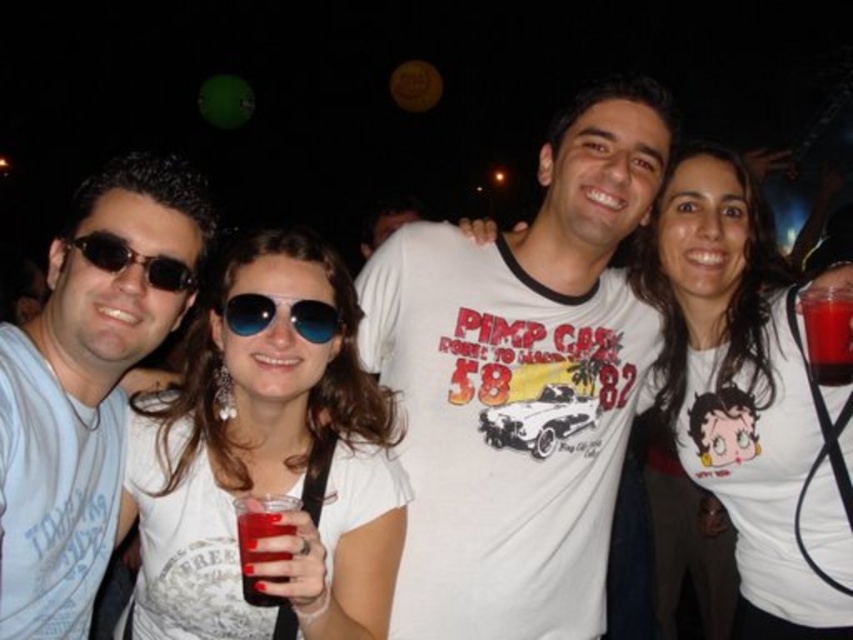
Question: Estimate the real-world distances between objects in this image. Which object is closer to the translucent plastic cup at right?

Choices:
 (A) white matte sunglasses at center
 (B) matte white t-shirt at left

Answer: (A)

Question: Is white matte sunglasses at center thinner than matte black sunglasses at left?

Choices:
 (A) no
 (B) yes

Answer: (A)

Question: Which point is closer to the camera?

Choices:
 (A) (22, 538)
 (B) (102, 266)
 (C) (474, 593)

Answer: (A)

Question: Which object is the farthest from the translucent plastic cup at right?

Choices:
 (A) white cotton t-shirt at center
 (B) blue reflective sunglasses at center
 (C) matte white t-shirt at left
 (D) white matte t-shirt at center

Answer: (C)

Question: Is white cotton t-shirt at center above matte white t-shirt at left?

Choices:
 (A) yes
 (B) no

Answer: (A)

Question: In this image, where is blue reflective sunglasses at center located relative to matte black sunglasses at left?

Choices:
 (A) left
 (B) right

Answer: (B)